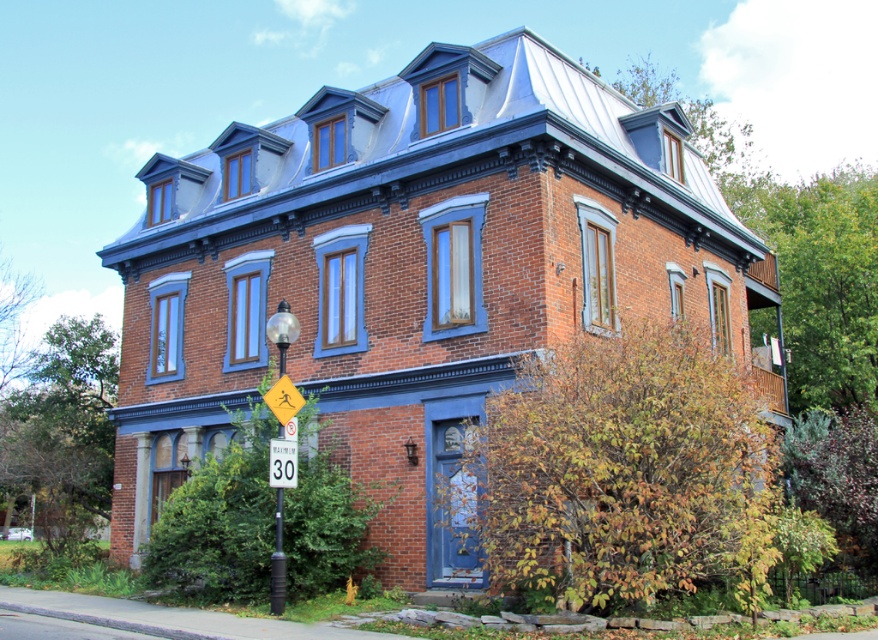
You are driving a car and see the yellow plastic sign at lower center and the white plastic speed limit sign at center. Which one is positioned lower on the road?

The yellow plastic sign at lower center is positioned lower than the white plastic speed limit sign at center.

You are standing in front of the house and want to place a new sign exactly where the yellow plastic sign at lower center is currently located. What coordinates should you use to position the new sign?

The coordinates for the yellow plastic sign at lower center are at point (277, 563), so you should place the new sign at those coordinates.

Consider the image. You are standing in front of the house and notice two points marked on the facade. The first point is at coordinate point (x=275, y=563) and the second is at point (x=272, y=464). Which point is closer to you?

Point (x=275, y=563) is closer to the viewer than point (x=272, y=464).